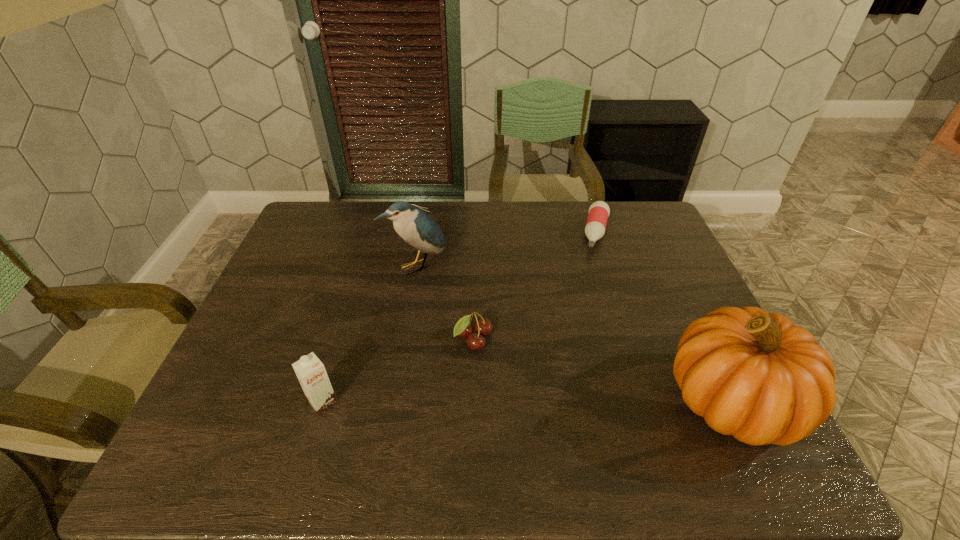
The height and width of the screenshot is (540, 960). Find the location of `free space between the bottle and the cherry`. free space between the bottle and the cherry is located at coordinates (536, 286).

I want to click on vacant area that lies between the shortest object and the pumpkin, so click(664, 316).

Image resolution: width=960 pixels, height=540 pixels. Identify the location of free spot between the third object from right to left and the pumpkin. (603, 370).

Locate an element on the screen. Image resolution: width=960 pixels, height=540 pixels. unoccupied area between the bird and the third shortest object is located at coordinates (370, 333).

Image resolution: width=960 pixels, height=540 pixels. Identify the location of empty space between the third object from right to left and the third tallest object. (398, 370).

At what (x,y) coordinates should I click in order to perform the action: click on vacant area that lies between the fourth object from right to left and the bottle. Please return your answer as a coordinate pair (x, y). Looking at the image, I should click on (507, 249).

Find the location of a particular element. empty location between the third object from left to right and the pumpkin is located at coordinates (603, 370).

Identify the location of unoccupied position between the pumpkin and the shortest object. This screenshot has width=960, height=540. (664, 316).

The height and width of the screenshot is (540, 960). In order to click on free area in between the shortest object and the bird in this screenshot , I will do tap(507, 249).

Locate which object ranks third in proximity to the bottle. Please provide its 2D coordinates. Your answer should be formatted as a tuple, i.e. [(x, y)], where the tuple contains the x and y coordinates of a point satisfying the conditions above.

[(417, 228)]